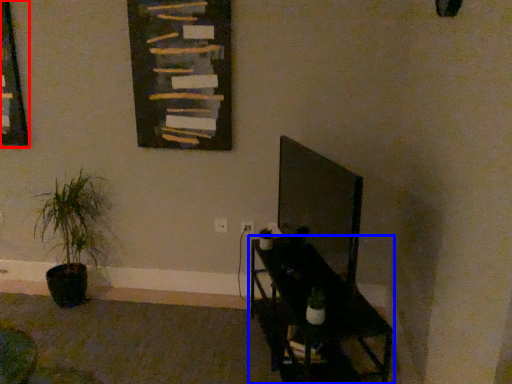
Question: Among these objects, which one is farthest to the camera, picture frame (highlighted by a red box) or furniture (highlighted by a blue box)?

Choices:
 (A) picture frame
 (B) furniture

Answer: (A)